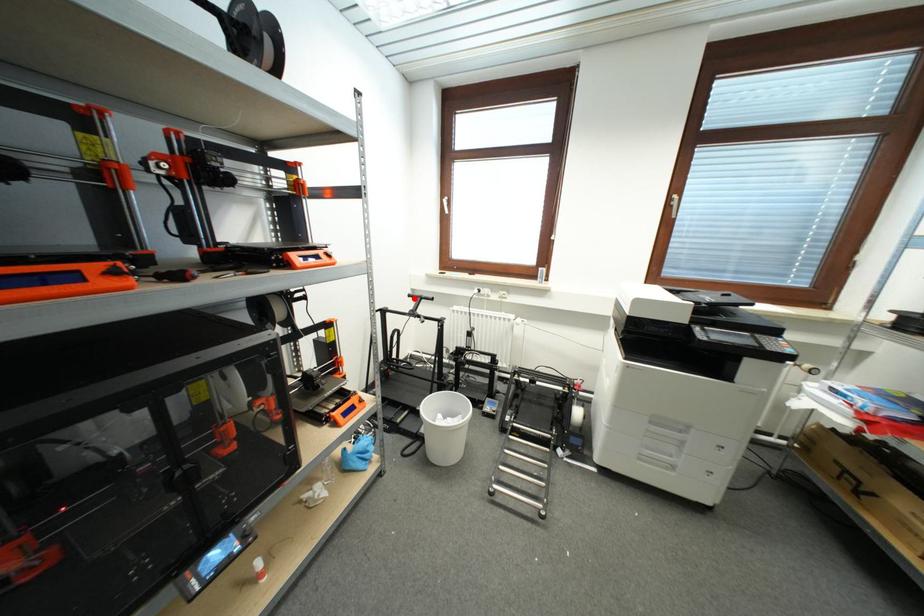
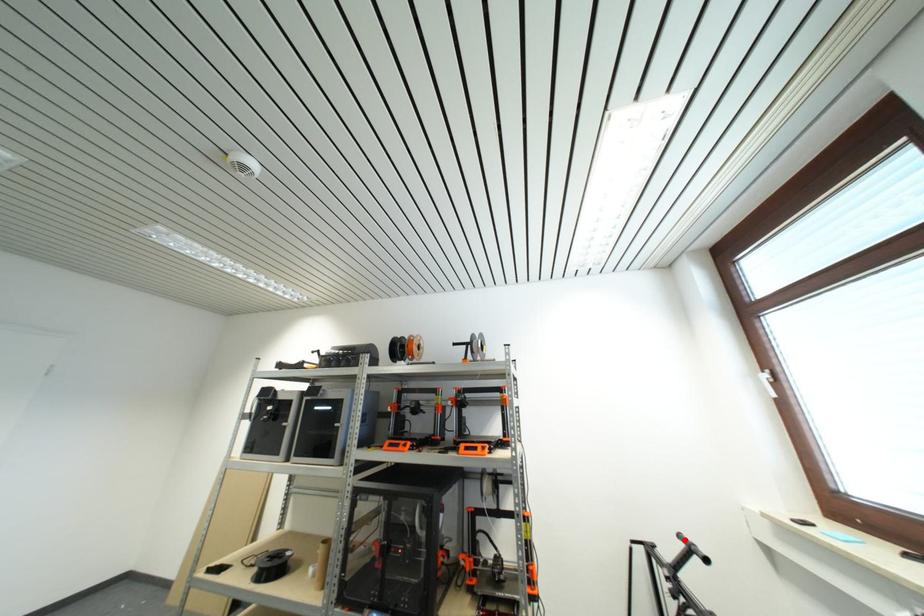
I am providing you with two images of the same scene from different viewpoints. A red point is marked on the first image and another point is marked on the second image. Does the point marked in image1 correspond to the same location as the one in image2?

Yes